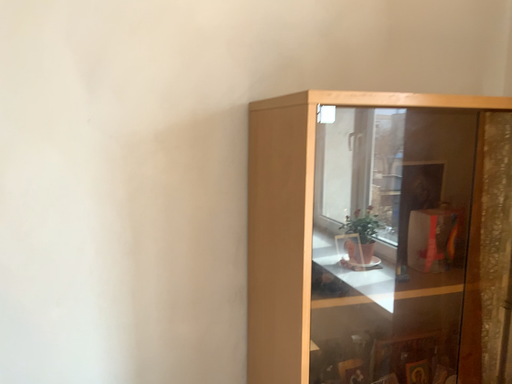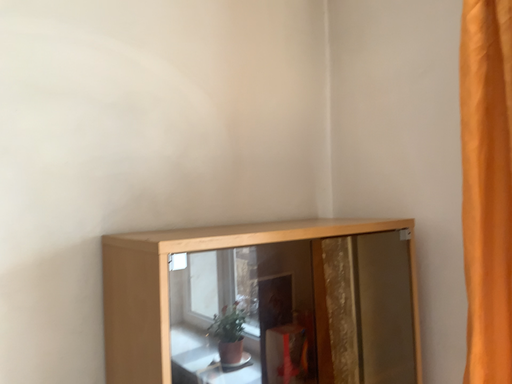
Question: Which way did the camera rotate in the video?

Choices:
 (A) rotated upward
 (B) rotated downward

Answer: (A)